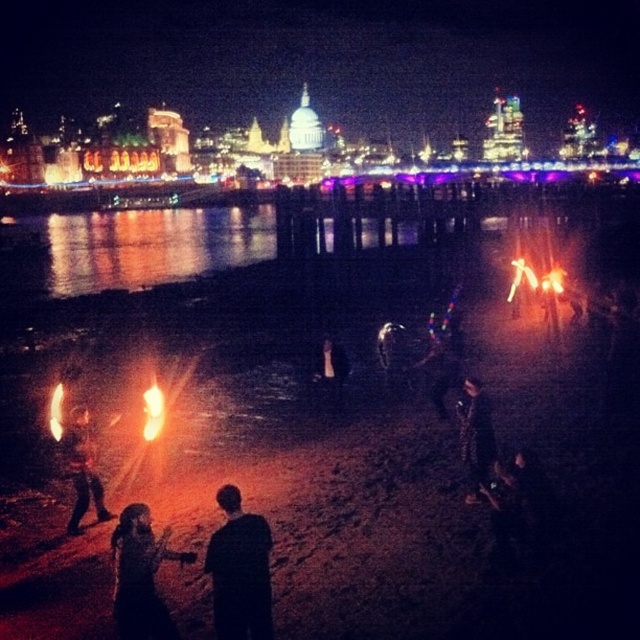
You are a photographer aiming to capture the vibrant fire performance at the waterfront. You notice a point at coordinates (x=240, y=570) in the image. Based on the scene description, what object is located at this point?

The point at coordinates (x=240, y=570) is on the black matte jacket at center.

You are a photographer trying to capture the fire performers at the waterfront. You notice the shiny metallic fire at lower left and the dark fabric jacket at center. Which object should you focus on if you want to capture the larger subject in your shot?

The shiny metallic fire at lower left is larger in size than the dark fabric jacket at center, so you should focus on the shiny metallic fire at lower left to capture the larger subject.

You are a photographer standing at the waterfront and want to capture both the black matte jacket at center and the dark fabric dress at lower center in a single shot. Which object will appear closer to the camera in the photo?

The black matte jacket at center will appear closer to the camera in the photo because it is further to the viewer than the dark fabric dress at lower center.